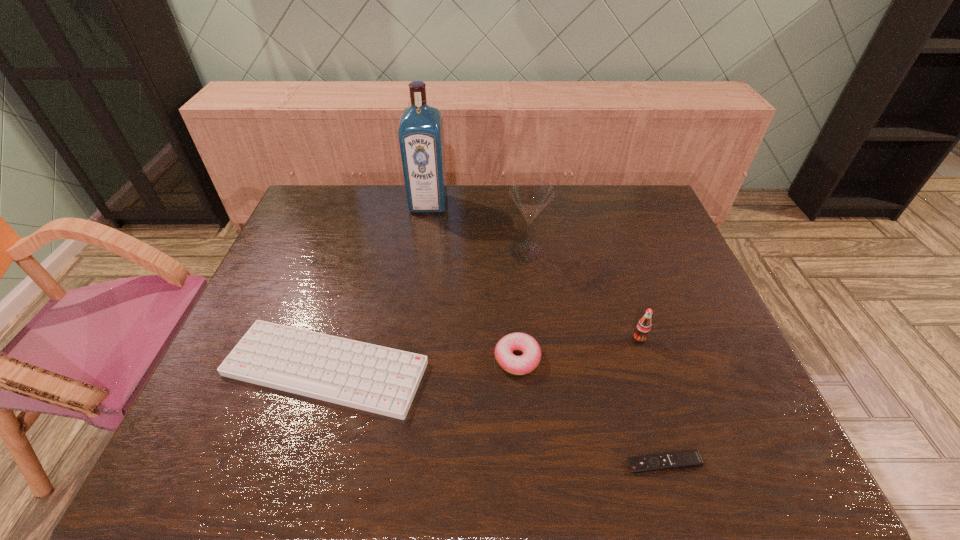
This screenshot has height=540, width=960. In the image, there is a desktop. Identify the location of vacant space at the left edge. (316, 282).

I want to click on vacant region at the right edge, so [x=684, y=264].

Identify the location of free space at the far left corner of the desktop. (302, 222).

You are a GUI agent. You are given a task and a screenshot of the screen. Output one action in this format:
    pyautogui.click(x=<x>, y=<y>)
    Task: Click on the empty space between the remote control and the third shortest object
    This screenshot has height=540, width=960.
    Given the screenshot: What is the action you would take?
    pyautogui.click(x=590, y=411)

Locate an element on the screen. vacant area that lies between the flute glass and the fourth shortest object is located at coordinates (583, 295).

Locate an element on the screen. The image size is (960, 540). unoccupied position between the nearest object and the tallest object is located at coordinates (546, 334).

Identify the location of vacant area that lies between the doughnut and the fifth shortest object. The width and height of the screenshot is (960, 540). (522, 305).

Identify the location of unoccupied area between the soda and the third shortest object. (578, 349).

Identify the location of free space between the flute glass and the fourth tallest object. (522, 305).

Image resolution: width=960 pixels, height=540 pixels. In order to click on vacant space that is in between the shortest object and the computer keyboard in this screenshot , I will do `click(494, 416)`.